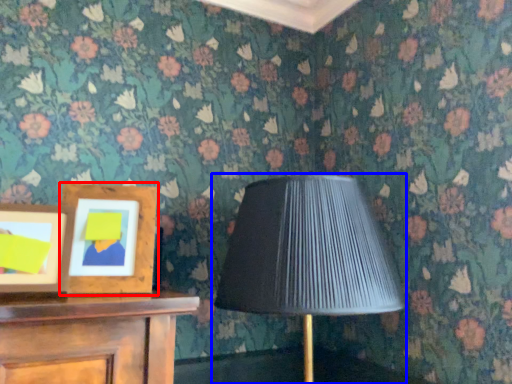
Question: Which object appears farthest to the camera in this image, picture frame (highlighted by a red box) or lamp (highlighted by a blue box)?

Choices:
 (A) picture frame
 (B) lamp

Answer: (A)